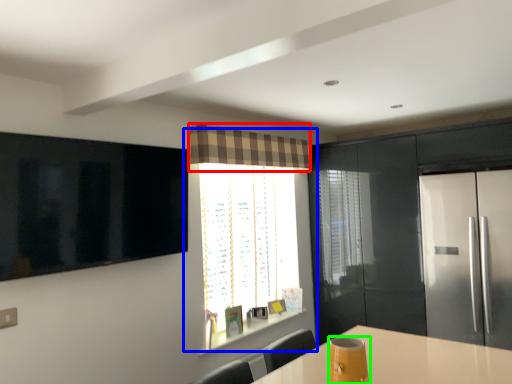
Question: Estimate the real-world distances between objects in this image. Which object is farther from curtain (highlighted by a red box), window (highlighted by a blue box) or appliance (highlighted by a green box)?

Choices:
 (A) window
 (B) appliance

Answer: (B)